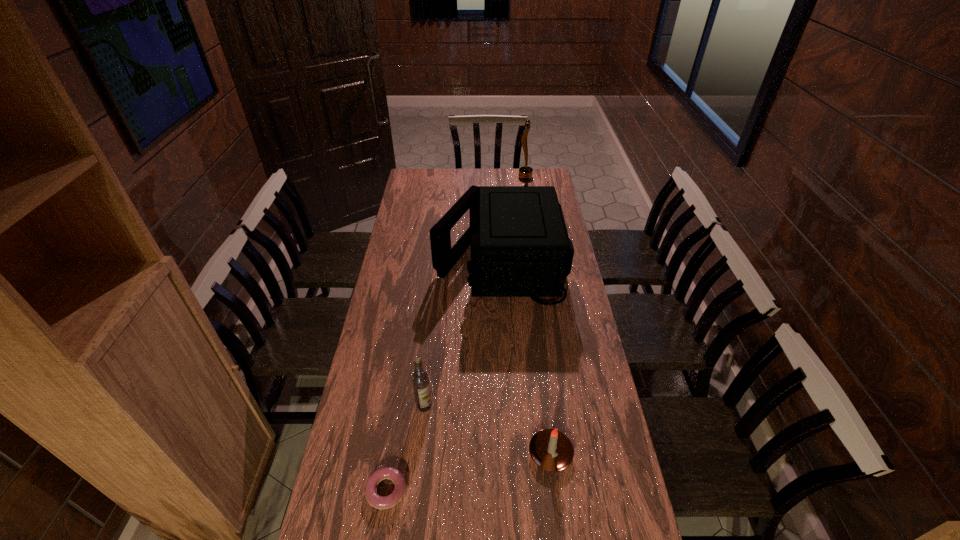
I want to click on candle situated at the right edge, so click(x=550, y=449).

This screenshot has width=960, height=540. What are the coordinates of `object located in the far right corner section of the desktop` in the screenshot? It's located at (525, 173).

This screenshot has height=540, width=960. In the image, there is a desktop. In order to click on vacant space at the far edge in this screenshot , I will do `click(458, 169)`.

Identify the location of blank area at the left edge. The height and width of the screenshot is (540, 960). (402, 285).

This screenshot has height=540, width=960. What are the coordinates of `vacant point at the far left corner` in the screenshot? It's located at (411, 191).

At what (x,y) coordinates should I click in order to perform the action: click on free space between the doughnut and the microwave oven. Please return your answer as a coordinate pair (x, y). Looking at the image, I should click on (444, 375).

Where is `vacant area between the farthest object and the candle`? The height and width of the screenshot is (540, 960). vacant area between the farthest object and the candle is located at coordinates (538, 315).

Where is `empty location between the doughnut and the farthest object`? empty location between the doughnut and the farthest object is located at coordinates (456, 334).

Identify the location of free spot between the third farthest object and the microwave oven. (463, 333).

You are a GUI agent. You are given a task and a screenshot of the screen. Output one action in this format:
    pyautogui.click(x=<x>, y=<y>)
    Task: Click on the empty space between the second farthest object and the third farthest object
    This screenshot has height=540, width=960.
    Given the screenshot: What is the action you would take?
    pyautogui.click(x=463, y=333)